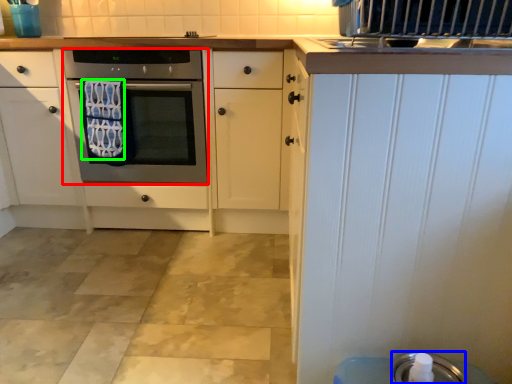
Question: Which object is positioned closest to oven (highlighted by a red box)? Select from appliance (highlighted by a blue box) and bath towel (highlighted by a green box).

Choices:
 (A) appliance
 (B) bath towel

Answer: (B)